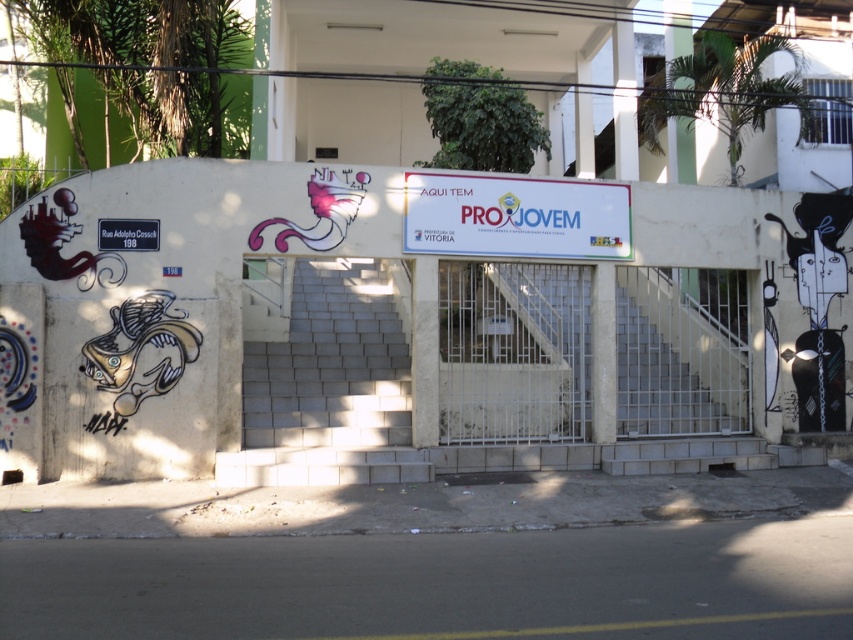
Is point (573, 236) behind point (131, 240)?

Yes, point (573, 236) is farther from viewer.

Where is `white plastic sign at center`? The height and width of the screenshot is (640, 853). white plastic sign at center is located at coordinates (515, 216).